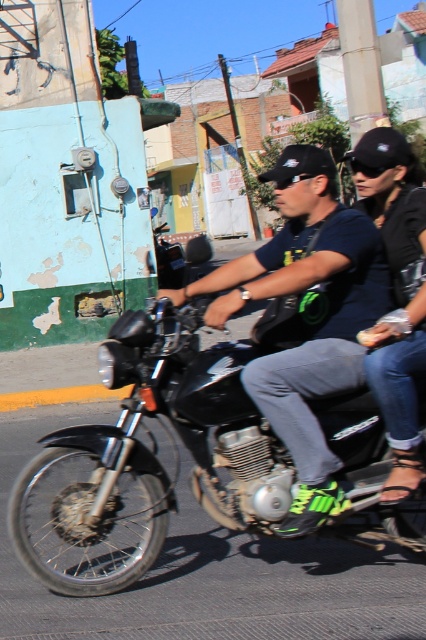
You are standing on the sidewalk and see the motorcycle rider wearing a dark blue T shirt and black cap. There is a point at coordinates (377,429). Can you reach that point with your 2.5 meter long measuring tape?

The point at coordinates (377,429) is 3.35 meters away from the viewer. Since the measuring tape is only 2.5 meters long, you cannot reach that point with it.

You are a delivery person needing to choose between the black matte motorcycle at center and the matte black motorcycle at center for a narrow alley delivery route. Which motorcycle should you choose based on their widths?

The matte black motorcycle at center has a smaller width than the black matte motorcycle at center, so you should choose the matte black motorcycle at center for the narrow alley delivery route.